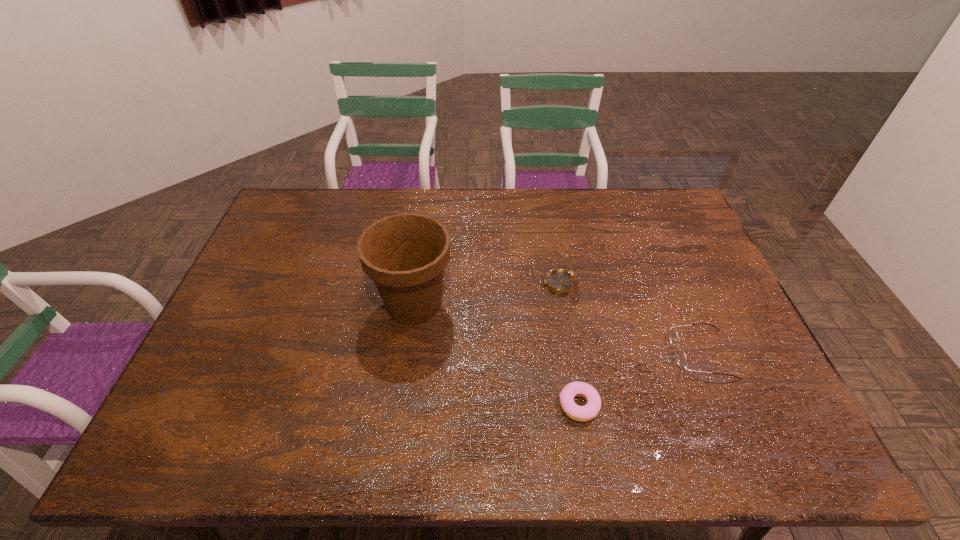
This screenshot has width=960, height=540. I want to click on free space between the compass and the tallest object, so click(x=486, y=294).

Locate an element on the screen. The width and height of the screenshot is (960, 540). object that can be found as the second closest to the second shortest object is located at coordinates (559, 281).

Locate an element on the screen. The height and width of the screenshot is (540, 960). the second closest object relative to the shortest object is located at coordinates (405, 254).

Identify the location of free space that satisfies the following two spatial constraints: 1. through the lenses of the rightmost object; 2. on the front side of the nearest object. (723, 405).

What are the coordinates of `vacant area that satisfies the following two spatial constraints: 1. on the front side of the doughnut; 2. on the left side of the flowerpot` in the screenshot? It's located at (400, 405).

Locate an element on the screen. Image resolution: width=960 pixels, height=540 pixels. free space in the image that satisfies the following two spatial constraints: 1. with the dial facing the nearest object; 2. on the left side of the compass is located at coordinates (579, 405).